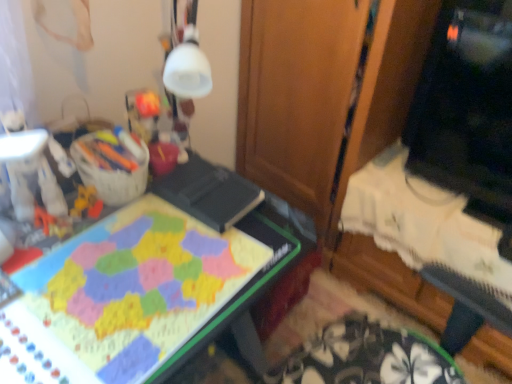
Find the location of a particular element. blank space situated above matte plastic board game at center (from a real-world perspective) is located at coordinates (128, 263).